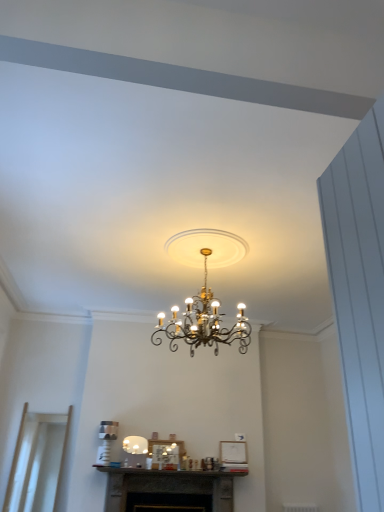
Question: Relative to white glossy lampshade at center, which ranks as the 2th lamp in top-to-bottom order, is dark gray stone fireplace at center in front or behind?

Choices:
 (A) front
 (B) behind

Answer: (A)

Question: Is dark gray stone fireplace at center to the left or to the right of white glossy lampshade at center, which is the 2th lamp in right-to-left order, in the image?

Choices:
 (A) left
 (B) right

Answer: (B)

Question: Which of these objects is positioned closest to the white glossy lampshade at center, which ranks as the 2th lamp in top-to-bottom order?

Choices:
 (A) dark gray stone fireplace at center
 (B) transparent glass door at lower left
 (C) gold metallic chandelier at center, which is the second lamp from bottom to top

Answer: (A)

Question: Estimate the real-world distances between objects in this image. Which object is farther from the dark gray stone fireplace at center?

Choices:
 (A) white glossy lampshade at center, which ranks as the 1th lamp in back-to-front order
 (B) transparent glass door at lower left
 (C) gold metallic chandelier at center, the 1th lamp positioned from the front

Answer: (C)